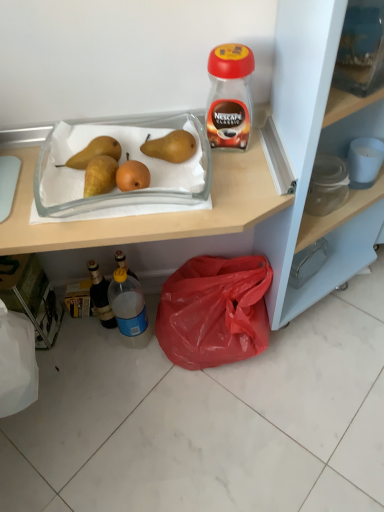
Where is `vacant space in front of matte plastic bag at lower center`? vacant space in front of matte plastic bag at lower center is located at coordinates (210, 436).